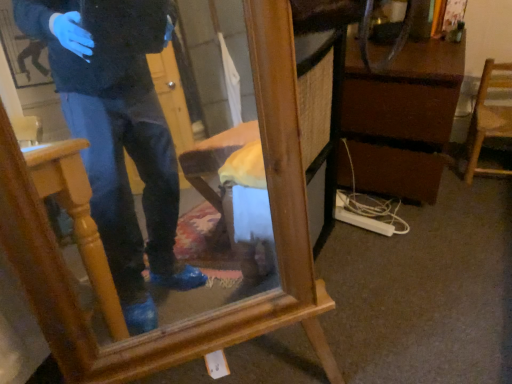
Question: From a real-world perspective, is brown wood vanity at center right above or below wooden mirror at center?

Choices:
 (A) above
 (B) below

Answer: (B)

Question: From the image's perspective, is brown wood vanity at center right positioned above or below wooden mirror at center?

Choices:
 (A) below
 (B) above

Answer: (B)

Question: Based on their relative distances, which object is farther from the wooden chair at right?

Choices:
 (A) brown wood vanity at center right
 (B) wooden mirror at center

Answer: (B)

Question: Based on their relative distances, which object is nearer to the brown wood vanity at center right?

Choices:
 (A) wooden chair at right
 (B) wooden mirror at center

Answer: (A)